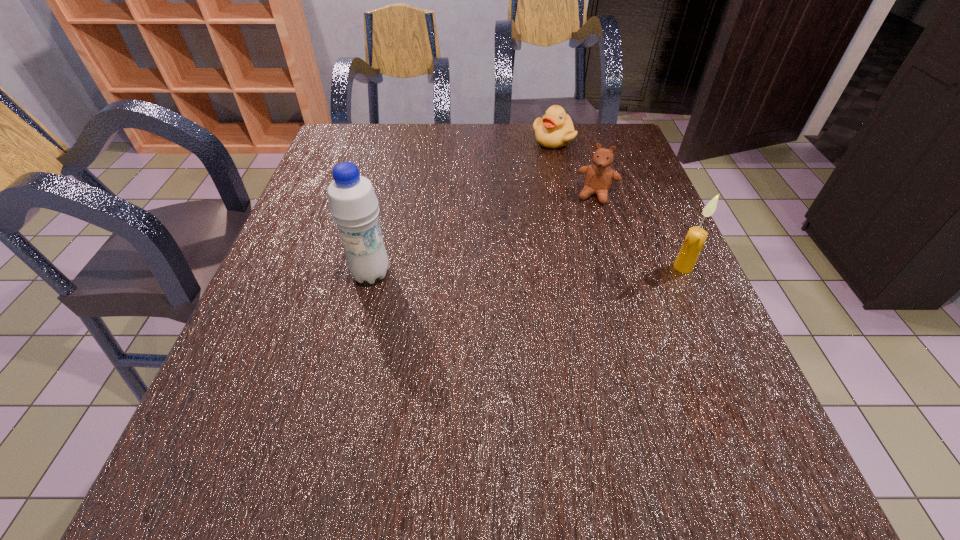
Where is `vacant region located 0.110m on the face of the third nearest object`? vacant region located 0.110m on the face of the third nearest object is located at coordinates (585, 233).

Find the location of a particular element. This screenshot has width=960, height=540. vacant space situated 0.130m on the face of the third nearest object is located at coordinates 583,238.

I want to click on free point located on the face of the third nearest object, so click(585, 233).

Identify the location of vacant space located on the beak of the shortest object. (547, 188).

Image resolution: width=960 pixels, height=540 pixels. Identify the location of blank space located on the beak of the shortest object. (545, 197).

Locate an element on the screen. This screenshot has height=540, width=960. free spot located 0.250m on the beak of the shortest object is located at coordinates (545, 201).

I want to click on object situated at the far edge, so click(x=555, y=130).

Find the location of a particular element. candle at the right edge is located at coordinates (695, 239).

Identify the location of teddy bear situated at the right edge. The height and width of the screenshot is (540, 960). (598, 177).

The width and height of the screenshot is (960, 540). I want to click on free space at the far edge, so click(x=540, y=165).